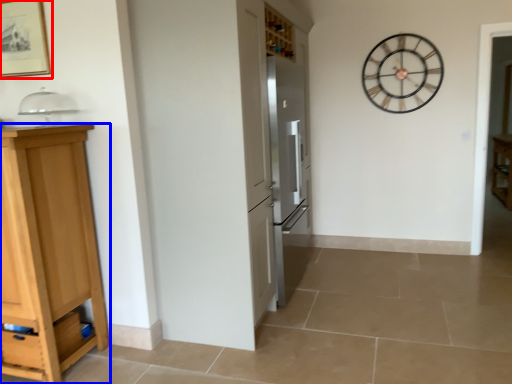
Question: Which point is further to the camera, picture frame (highlighted by a red box) or cabinetry (highlighted by a blue box)?

Choices:
 (A) picture frame
 (B) cabinetry

Answer: (A)